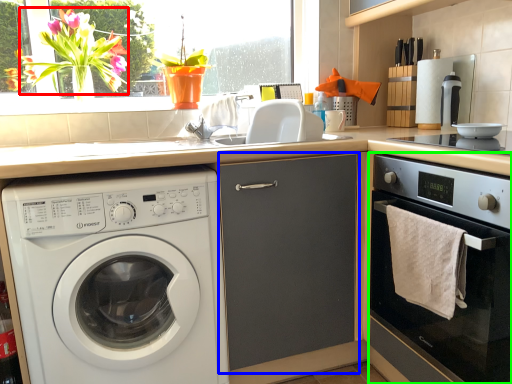
Question: Which object is the closest to the flower (highlighted by a red box)? Choose among these: screen door (highlighted by a blue box) or oven (highlighted by a green box).

Choices:
 (A) screen door
 (B) oven

Answer: (A)